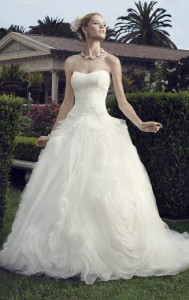
Find the location of a particular element. The image size is (189, 300). potted plants is located at coordinates (40, 90), (10, 85).